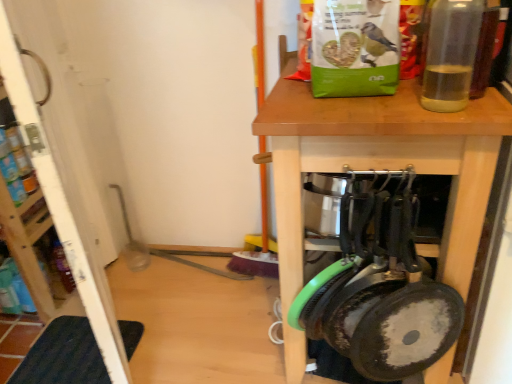
Question: Is transparent plastic bottle at upper right at the back of wooden table at center?

Choices:
 (A) yes
 (B) no

Answer: (B)

Question: Is wooden table at center at the right side of transparent plastic bottle at upper right?

Choices:
 (A) no
 (B) yes

Answer: (A)

Question: Is wooden table at center positioned before transparent plastic bottle at upper right?

Choices:
 (A) yes
 (B) no

Answer: (B)

Question: Is wooden table at center not within transparent plastic bottle at upper right?

Choices:
 (A) no
 (B) yes

Answer: (B)

Question: Considering the relative sizes of wooden table at center and transparent plastic bottle at upper right in the image provided, is wooden table at center bigger than transparent plastic bottle at upper right?

Choices:
 (A) no
 (B) yes

Answer: (B)

Question: From a real-world perspective, is wooden table at center located beneath transparent plastic bottle at upper right?

Choices:
 (A) no
 (B) yes

Answer: (B)

Question: Can you confirm if dark blue rubber mat at lower left is positioned to the left of white wood screen door at left?

Choices:
 (A) no
 (B) yes

Answer: (A)

Question: Is dark blue rubber mat at lower left wider than white wood screen door at left?

Choices:
 (A) yes
 (B) no

Answer: (A)

Question: Is the position of dark blue rubber mat at lower left less distant than that of white wood screen door at left?

Choices:
 (A) yes
 (B) no

Answer: (B)

Question: Is the position of dark blue rubber mat at lower left more distant than that of white wood screen door at left?

Choices:
 (A) no
 (B) yes

Answer: (B)

Question: Is dark blue rubber mat at lower left located outside white wood screen door at left?

Choices:
 (A) no
 (B) yes

Answer: (B)

Question: Does dark blue rubber mat at lower left have a larger size compared to white wood screen door at left?

Choices:
 (A) yes
 (B) no

Answer: (B)

Question: Is transparent plastic bottle at upper right wider than wooden table at center?

Choices:
 (A) yes
 (B) no

Answer: (B)